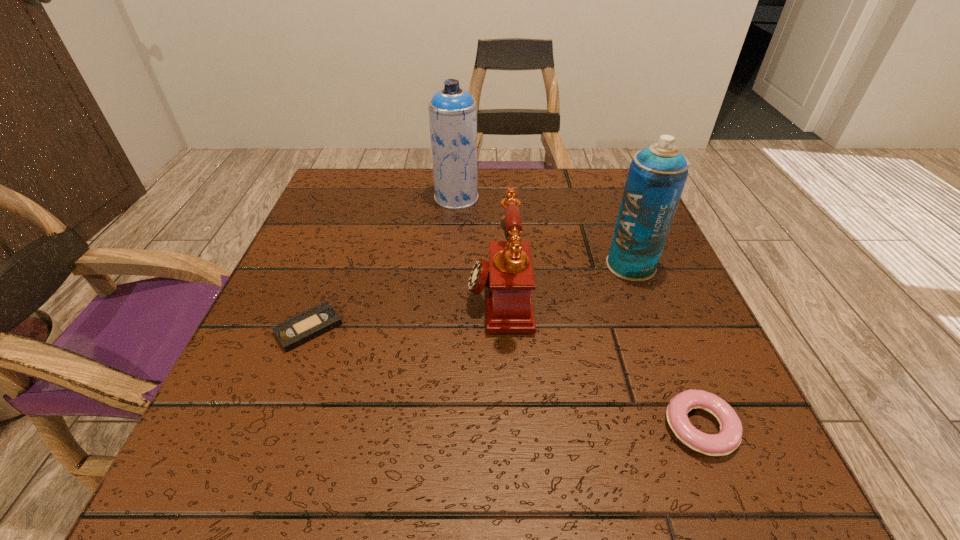
You are a GUI agent. You are given a task and a screenshot of the screen. Output one action in this format:
    pyautogui.click(x=<x>, y=<y>)
    Task: Click on the farthest object
    The image size is (960, 540).
    Given the screenshot: What is the action you would take?
    pyautogui.click(x=452, y=111)

The width and height of the screenshot is (960, 540). Identify the location of the left aerosol can. (452, 111).

At what (x,y) coordinates should I click in order to perform the action: click on the right aerosol can. Please return your answer as a coordinate pair (x, y). Looking at the image, I should click on (657, 175).

The height and width of the screenshot is (540, 960). I want to click on the third shortest object, so click(508, 277).

The width and height of the screenshot is (960, 540). Identify the location of the fourth tallest object. (729, 438).

At what (x,y) coordinates should I click in order to perform the action: click on the nearest object. Please return your answer as a coordinate pair (x, y). Looking at the image, I should click on (729, 438).

Image resolution: width=960 pixels, height=540 pixels. I want to click on the leftmost object, so click(301, 328).

Where is `videotape`? Image resolution: width=960 pixels, height=540 pixels. videotape is located at coordinates (301, 328).

You are a GUI agent. You are given a task and a screenshot of the screen. Output one action in this format:
    pyautogui.click(x=<x>, y=<y>)
    Task: Click on the vacant region located 0.370m on the right of the farther aerosol can
    
    Given the screenshot: What is the action you would take?
    pyautogui.click(x=633, y=198)

Where is `free space located on the left of the right aerosol can`? This screenshot has width=960, height=540. free space located on the left of the right aerosol can is located at coordinates (470, 266).